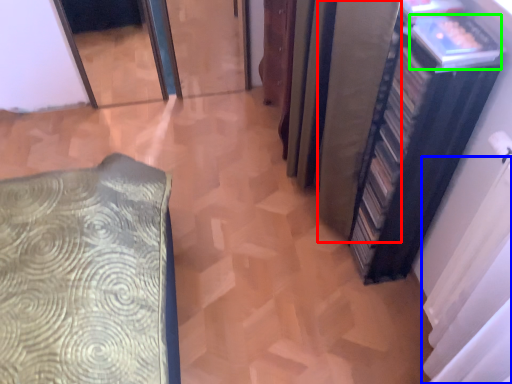
Question: Estimate the real-world distances between objects in this image. Which object is farther from curtain (highlighted by a red box), curtain (highlighted by a blue box) or book (highlighted by a green box)?

Choices:
 (A) curtain
 (B) book

Answer: (A)